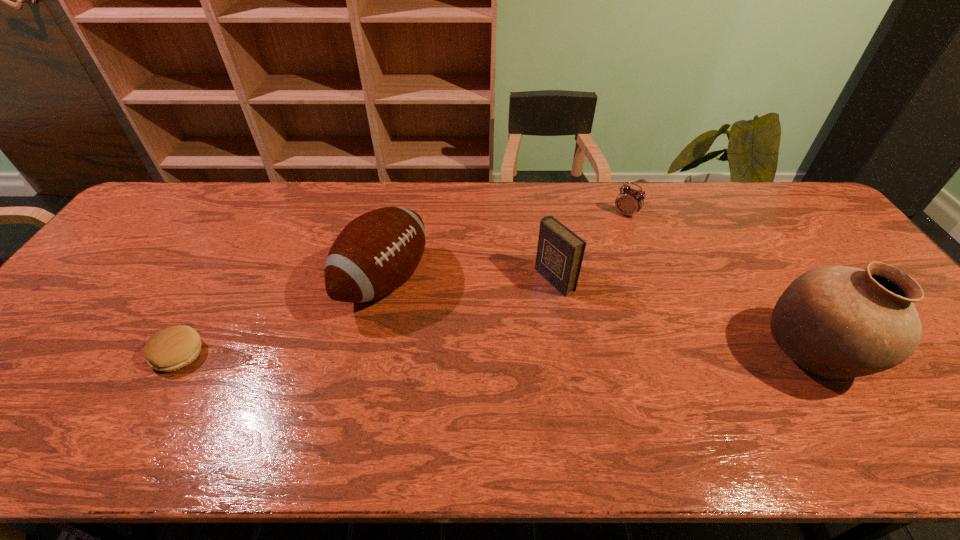
Find the location of a particular element. The image size is (960, 540). free space located 0.250m on the left of the patty is located at coordinates (50, 354).

Identify the location of vacant space located on the back of the pottery. This screenshot has width=960, height=540. (742, 242).

The height and width of the screenshot is (540, 960). I want to click on vacant region located on the laces of the fourth object from right to left, so click(483, 333).

Locate an element on the screen. free space located on the laces of the fourth object from right to left is located at coordinates pos(512,346).

Image resolution: width=960 pixels, height=540 pixels. In order to click on free location located 0.170m on the laces of the fourth object from right to left in this screenshot , I will do `click(473, 328)`.

This screenshot has width=960, height=540. Find the location of `free space located on the front cover of the diary`. free space located on the front cover of the diary is located at coordinates (520, 300).

Find the location of a particular element. free spot located 0.330m on the front cover of the diary is located at coordinates (437, 346).

The image size is (960, 540). Identify the location of vacant region located 0.060m on the front cover of the diary. (523, 299).

I want to click on vacant area located on the face of the second shortest object, so click(x=562, y=296).

Where is `free spot located 0.060m on the face of the second shortest object`? The image size is (960, 540). free spot located 0.060m on the face of the second shortest object is located at coordinates (612, 230).